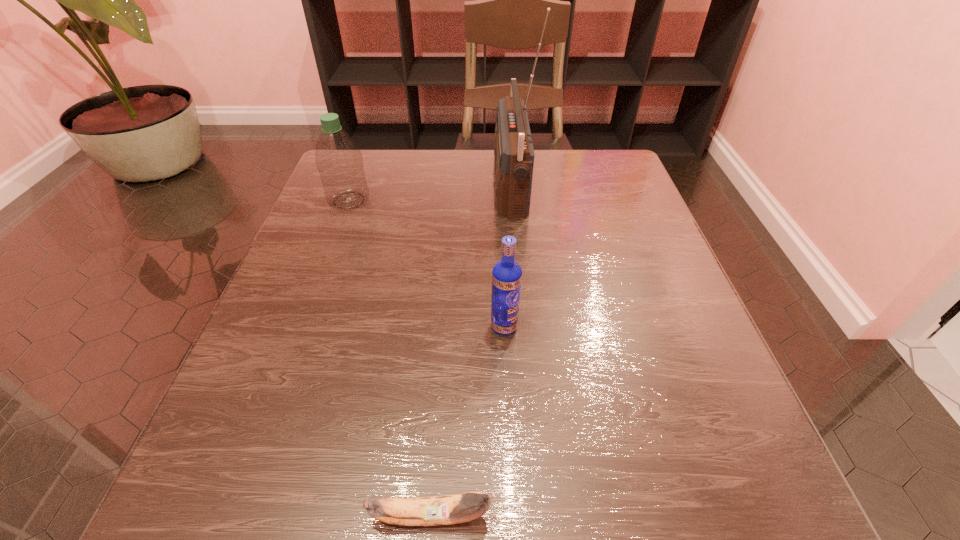
In order to click on vacant space at the far left corner in this screenshot , I will do `click(382, 158)`.

Where is `blank space at the near left corner of the desktop`? The image size is (960, 540). blank space at the near left corner of the desktop is located at coordinates click(272, 472).

Identify the location of vacant space at the far right corner of the desktop. The height and width of the screenshot is (540, 960). (632, 191).

Find the location of a particular element. empty location between the vodka and the leftmost object is located at coordinates pos(426,264).

The image size is (960, 540). I want to click on empty space between the radio receiver and the water bottle, so click(429, 193).

You are a GUI agent. You are given a task and a screenshot of the screen. Output one action in this format:
    pyautogui.click(x=<x>, y=<y>)
    Task: Click on the vacant area that lies between the nearest object and the third farthest object
    
    Given the screenshot: What is the action you would take?
    pyautogui.click(x=468, y=421)

The height and width of the screenshot is (540, 960). Find the location of `empty space that is in between the leftmost object and the second nearest object`. empty space that is in between the leftmost object and the second nearest object is located at coordinates (426, 264).

Locate an element on the screen. empty space between the second nearest object and the leftmost object is located at coordinates (426, 264).

At what (x,y) coordinates should I click in order to perform the action: click on empty space that is in between the third object from right to left and the leftmost object. Please return your answer as a coordinate pair (x, y). This screenshot has width=960, height=540. Looking at the image, I should click on (390, 358).

I want to click on blank region between the vodka and the third object from right to left, so click(468, 421).